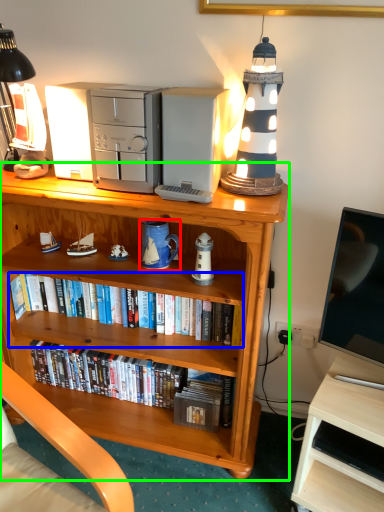
Question: Which is farther away from mug (highlighted by a red box)? book (highlighted by a blue box) or bookcase (highlighted by a green box)?

Choices:
 (A) book
 (B) bookcase

Answer: (B)